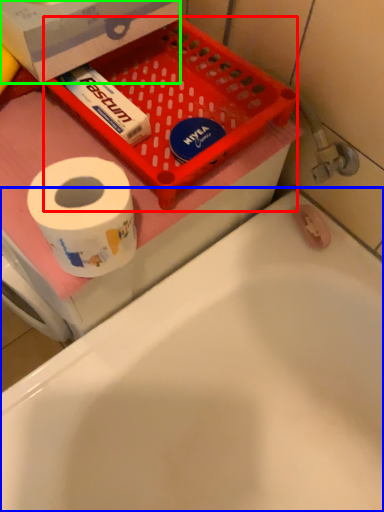
Question: Based on their relative distances, which object is farther from basket (highlighted by a red box)? Choose from bathtub (highlighted by a blue box) and box (highlighted by a green box).

Choices:
 (A) bathtub
 (B) box

Answer: (A)